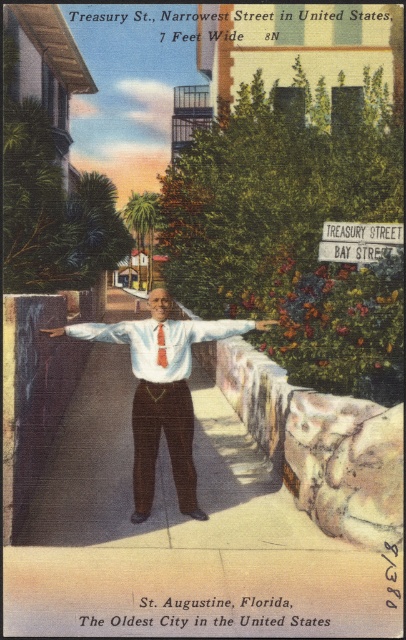
You are a tourist standing on Treasury Street, the narrowest street in the US, and you see two points marked on the ground. The first point is at coordinate point (200, 516) and the second is at point (71, 326). If you want to walk from the first point to the second, will you be moving towards the street entrance or exit?

Since point (200, 516) is in front of point (71, 326), walking from the first to the second point means you are moving towards the street exit.